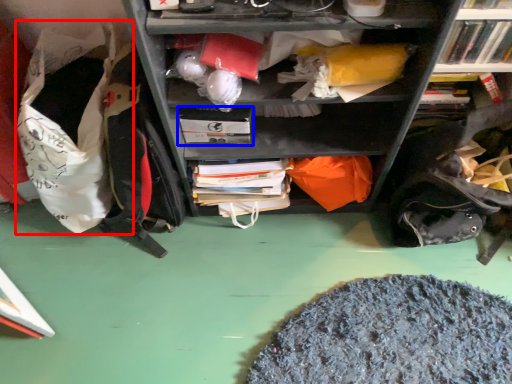
Question: Which object appears farthest to the camera in this image, bean bag chair (highlighted by a red box) or paperback book (highlighted by a blue box)?

Choices:
 (A) bean bag chair
 (B) paperback book

Answer: (B)